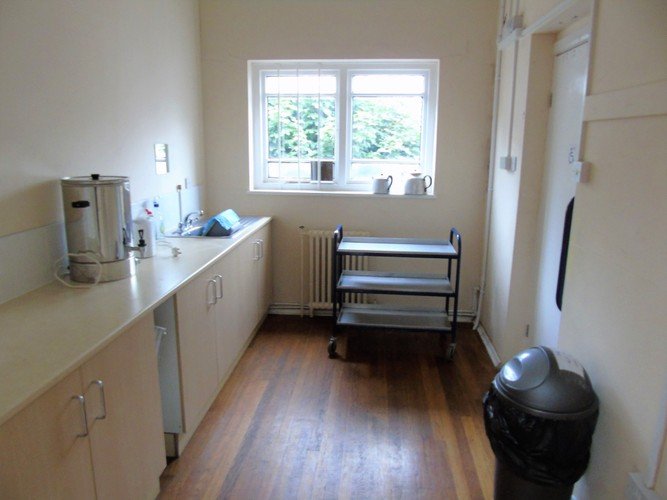
I want to click on plastic garbage bag, so click(564, 451), click(509, 430).